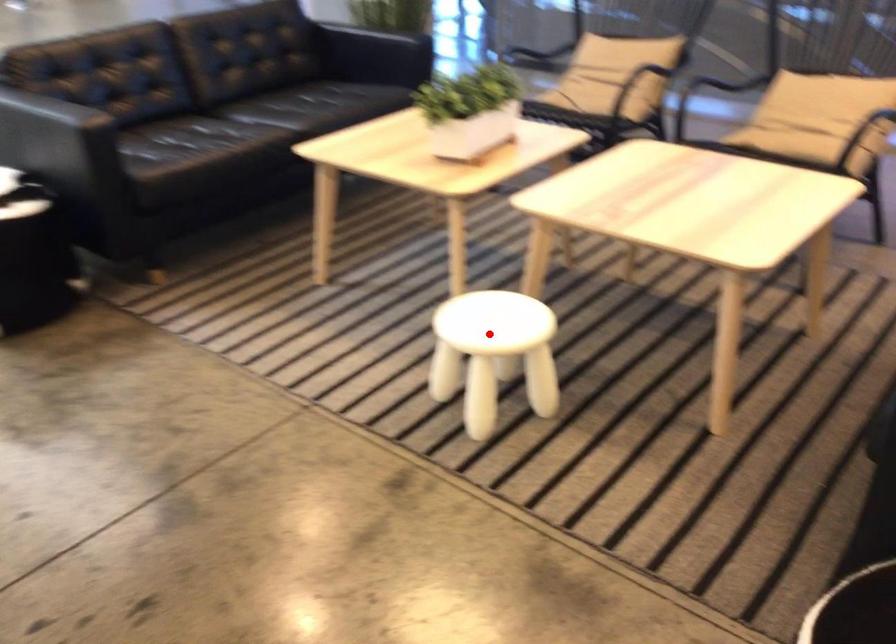
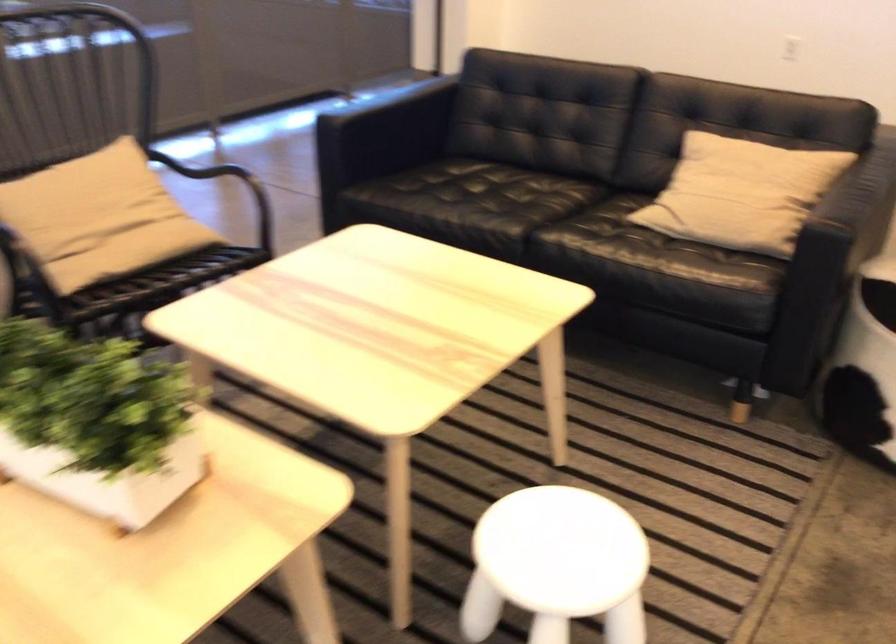
The point at the highlighted location is marked in the first image. Where is the corresponding point in the second image?

(556, 565)